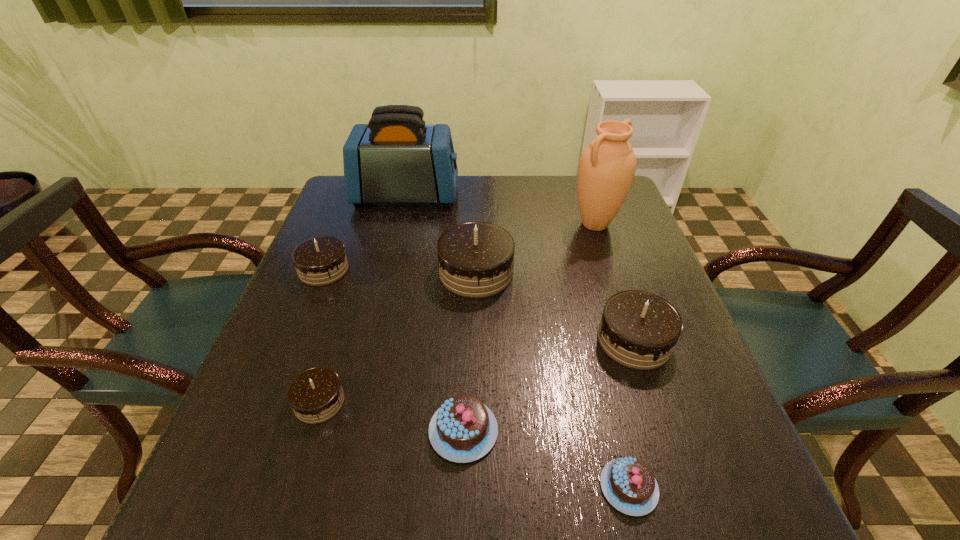
At what (x,y) coordinates should I click in order to perform the action: click on urn. Please return your answer as a coordinate pair (x, y). This screenshot has height=540, width=960. Looking at the image, I should click on (607, 166).

Find the location of a particular element. Image resolution: width=960 pixels, height=540 pixels. blue toaster is located at coordinates (396, 158).

Identify the location of the tallest chocolate cake. (476, 259).

Identify the location of the sixth shortest object. (476, 259).

This screenshot has height=540, width=960. Find the location of `the fifth shortest chocolate cake`. the fifth shortest chocolate cake is located at coordinates click(639, 330).

Identify the location of the rightmost chocolate chocolate cake. (639, 330).

Locate an element on the screen. This screenshot has width=960, height=540. the third tallest chocolate cake is located at coordinates (321, 260).

At what (x,y) coordinates should I click in order to perform the action: click on the third biggest chocolate chocolate cake. Please return your answer as a coordinate pair (x, y). The width and height of the screenshot is (960, 540). Looking at the image, I should click on (321, 260).

The height and width of the screenshot is (540, 960). Identify the location of the smallest chocolate chocolate cake. (316, 395).

You are a GUI agent. You are given a task and a screenshot of the screen. Output one action in this format:
    pyautogui.click(x=<x>, y=<y>)
    Task: Click on the bigger pink chocolate cake
    The height and width of the screenshot is (540, 960).
    Given the screenshot: What is the action you would take?
    pyautogui.click(x=463, y=429)